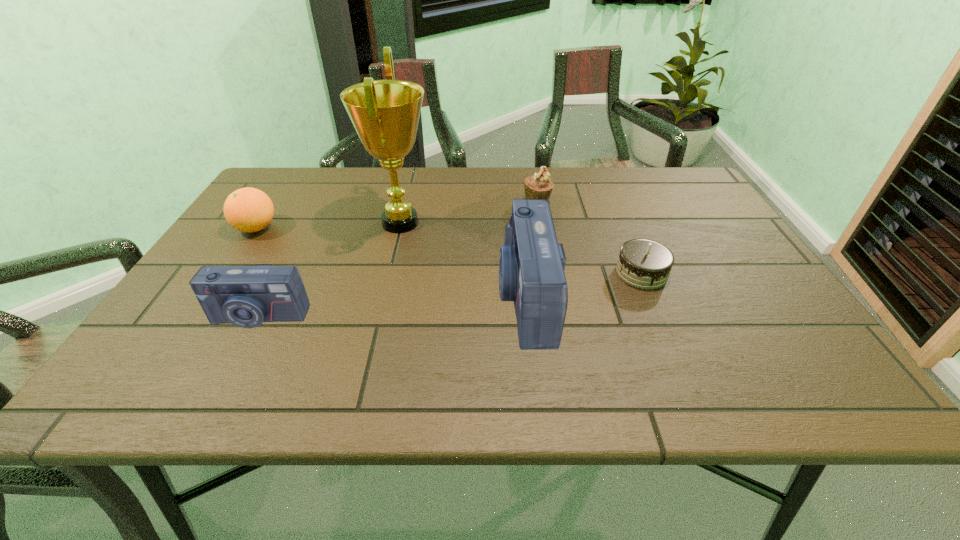
The height and width of the screenshot is (540, 960). I want to click on the shorter camera, so coord(246,296).

In order to click on the right camera in this screenshot , I will do `click(531, 263)`.

The width and height of the screenshot is (960, 540). In order to click on the fifth shortest object in this screenshot , I will do `click(531, 263)`.

Image resolution: width=960 pixels, height=540 pixels. Find the location of `muffin`. muffin is located at coordinates (539, 186).

I want to click on orange, so (248, 209).

At what (x,y) coordinates should I click in order to perform the action: click on the fourth object from right to left. Please return your answer as a coordinate pair (x, y). This screenshot has width=960, height=540. Looking at the image, I should click on (385, 113).

Locate an element on the screen. award is located at coordinates (385, 113).

Locate an element on the screen. the shortest object is located at coordinates (645, 264).

Locate an element on the screen. chocolate cake is located at coordinates (645, 264).

Identify the location of free region located 0.060m on the lens of the shorter camera. The width and height of the screenshot is (960, 540). (239, 354).